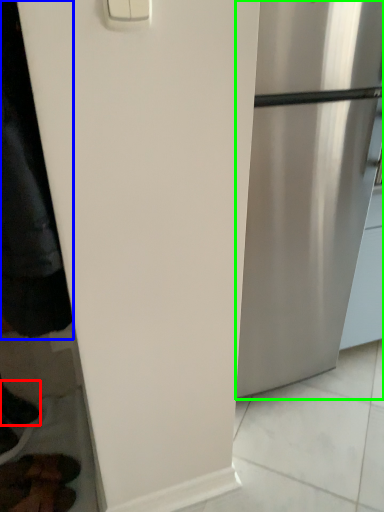
Question: Based on their relative distances, which object is nearer to shoe (highlighted by a red box)? Choose from jacket (highlighted by a blue box) and refrigerator (highlighted by a green box).

Choices:
 (A) jacket
 (B) refrigerator

Answer: (A)